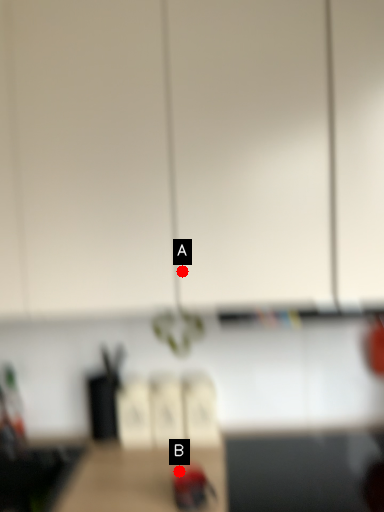
Question: Two points are circled on the image, labeled by A and B beside each circle. Which point appears farthest from the camera in this image?

Choices:
 (A) A is further
 (B) B is further

Answer: (B)